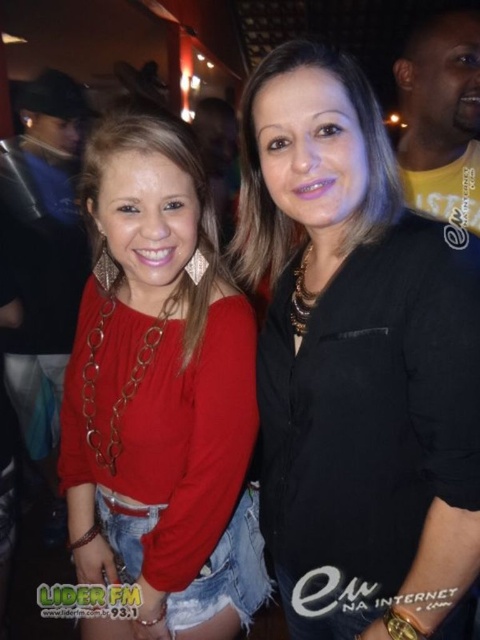
You are a photographer at the event and need to ensure both the black matte shirt at center and the matte red blouse at center are visible in the photo. Given their sizes, which one might you need to adjust your camera angle to better capture?

The black matte shirt at center is bigger than the matte red blouse at center, so you might need to adjust your camera angle to ensure the larger black matte shirt at center does not overshadow the smaller matte red blouse at center.

In the scene shown: You are standing at the origin point in the image and want to take a photo of both the point at (x=392, y=493) and the point at (x=191, y=412). Which point should you focus on first to ensure both are in frame?

You should focus on point (x=392, y=493) first since it is in front of point (x=191, y=412), ensuring both are visible in the frame.

You are a photographer at the event and need to adjust the lighting so both the black matte shirt at center and the matte red blouse at center are equally illuminated. Given their heights, which one might require a taller light stand to ensure proper lighting coverage?

The black matte shirt at center is taller than the matte red blouse at center, so the photographer should use a taller light stand for the black matte shirt at center to ensure proper lighting coverage.